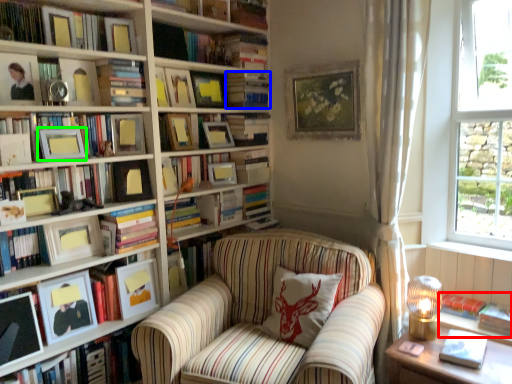
Question: Based on their relative distances, which object is nearer to book (highlighted by a red box)? Choose from book (highlighted by a blue box) and picture frame (highlighted by a green box).

Choices:
 (A) book
 (B) picture frame

Answer: (A)